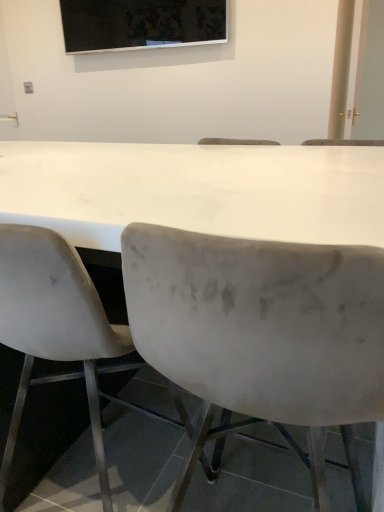
The image size is (384, 512). What are the coordinates of `black glossy screen at upper center` in the screenshot? It's located at (140, 24).

Where is `velvet gray chair at center, the second chair when ordered from left to right`? velvet gray chair at center, the second chair when ordered from left to right is located at coordinates (261, 325).

You are a GUI agent. You are given a task and a screenshot of the screen. Output one action in this format:
    pyautogui.click(x=<x>, y=<y>)
    Task: Click on the chair below the velvet gray chair at center, the second chair when ordered from left to right (from a real-world perspective)
    The width and height of the screenshot is (384, 512).
    Given the screenshot: What is the action you would take?
    click(x=60, y=330)

Considering their positions, is velvet gray chair at center, which is counted as the 1th chair, starting from the right, located in front of or behind white matte chair at left, arranged as the 2th chair when viewed from the right?

In the image, velvet gray chair at center, which is counted as the 1th chair, starting from the right, appears in front of white matte chair at left, arranged as the 2th chair when viewed from the right.

Looking at this image, is velvet gray chair at center, which is counted as the 1th chair, starting from the right, located outside white matte chair at left, positioned as the first chair in left-to-right order?

Yes, velvet gray chair at center, which is counted as the 1th chair, starting from the right, is not within white matte chair at left, positioned as the first chair in left-to-right order.

From a real-world perspective, which object stands above the other?

velvet gray chair at center, which is counted as the 1th chair, starting from the right.

Is white glossy door at upper right bigger or smaller than white matte chair at left, arranged as the 2th chair when viewed from the right?

Clearly, white glossy door at upper right is smaller in size than white matte chair at left, arranged as the 2th chair when viewed from the right.

From a real-world perspective, is white glossy door at upper right positioned above or below white matte chair at left, arranged as the 2th chair when viewed from the right?

white glossy door at upper right is situated higher than white matte chair at left, arranged as the 2th chair when viewed from the right, in the real world.

Which object is wider, white glossy door at upper right or white matte chair at left, arranged as the 2th chair when viewed from the right?

white matte chair at left, arranged as the 2th chair when viewed from the right.

Is white glossy door at upper right positioned behind white matte chair at left, positioned as the first chair in left-to-right order?

Yes.

Which of these two, black glossy screen at upper center or white glossy door at upper right, is wider?

With larger width is black glossy screen at upper center.

From a real-world perspective, who is located higher, black glossy screen at upper center or white glossy door at upper right?

black glossy screen at upper center, from a real-world perspective.

Based on the photo, is black glossy screen at upper center not inside white glossy door at upper right?

That's correct, black glossy screen at upper center is outside of white glossy door at upper right.

Does black glossy screen at upper center appear on the right side of white glossy door at upper right?

No, black glossy screen at upper center is not to the right of white glossy door at upper right.

Is velvet gray chair at center, the second chair when ordered from left to right, inside white matte chair at left, positioned as the first chair in left-to-right order?

No, velvet gray chair at center, the second chair when ordered from left to right, is not surrounded by white matte chair at left, positioned as the first chair in left-to-right order.

Where is `chair above the velvet gray chair at center, the second chair when ordered from left to right (from the image's perspective)`? chair above the velvet gray chair at center, the second chair when ordered from left to right (from the image's perspective) is located at coordinates (60, 330).

Which point is more forward, (35, 337) or (180, 327)?

The point (180, 327) is in front.

Is black glossy screen at upper center completely or partially outside of white matte chair at left, arranged as the 2th chair when viewed from the right?

black glossy screen at upper center is positioned outside white matte chair at left, arranged as the 2th chair when viewed from the right.

Are black glossy screen at upper center and white matte chair at left, positioned as the first chair in left-to-right order, beside each other?

There is a gap between black glossy screen at upper center and white matte chair at left, positioned as the first chair in left-to-right order.

Is the depth of black glossy screen at upper center less than that of white matte chair at left, positioned as the first chair in left-to-right order?

That is False.

From the image's perspective, between white glossy door at upper right and velvet gray chair at center, which is counted as the 1th chair, starting from the right, which one is located above?

white glossy door at upper right appears higher in the image.

From a real-world perspective, is white glossy door at upper right positioned above or below velvet gray chair at center, which is counted as the 1th chair, starting from the right?

white glossy door at upper right is above velvet gray chair at center, which is counted as the 1th chair, starting from the right.

What's the angular difference between white glossy door at upper right and velvet gray chair at center, which is counted as the 1th chair, starting from the right,'s facing directions?

The angular difference between white glossy door at upper right and velvet gray chair at center, which is counted as the 1th chair, starting from the right, is 88.3 degrees.

Is the surface of white glossy door at upper right in direct contact with velvet gray chair at center, which is counted as the 1th chair, starting from the right?

No.

Between white glossy door at upper right and black glossy screen at upper center, which one is positioned behind?

white glossy door at upper right is more distant.

From the image's perspective, between white glossy door at upper right and black glossy screen at upper center, which one is located above?

black glossy screen at upper center, from the image's perspective.

Looking at their sizes, would you say white glossy door at upper right is wider or thinner than black glossy screen at upper center?

Clearly, white glossy door at upper right has less width compared to black glossy screen at upper center.

The width and height of the screenshot is (384, 512). Identify the location of chair located on the right of white matte chair at left, arranged as the 2th chair when viewed from the right. (261, 325).

Find the location of a particular element. the 1st chair positioned below the white glossy door at upper right (from the image's perspective) is located at coordinates (60, 330).

Based on the photo, based on their spatial positions, is white glossy door at upper right or black glossy screen at upper center closer to velvet gray chair at center, which is counted as the 1th chair, starting from the right?

Among the two, white glossy door at upper right is located nearer to velvet gray chair at center, which is counted as the 1th chair, starting from the right.

From the image, which object appears to be farther from white glossy door at upper right, velvet gray chair at center, the second chair when ordered from left to right, or black glossy screen at upper center?

Among the two, velvet gray chair at center, the second chair when ordered from left to right, is located further to white glossy door at upper right.

From the image, which object appears to be nearer to black glossy screen at upper center, white matte chair at left, positioned as the first chair in left-to-right order, or velvet gray chair at center, the second chair when ordered from left to right?

white matte chair at left, positioned as the first chair in left-to-right order.

When comparing their distances from white glossy door at upper right, does black glossy screen at upper center or white matte chair at left, arranged as the 2th chair when viewed from the right, seem closer?

black glossy screen at upper center lies closer to white glossy door at upper right than the other object.

Looking at the image, which one is located further to white glossy door at upper right, velvet gray chair at center, the second chair when ordered from left to right, or white matte chair at left, positioned as the first chair in left-to-right order?

velvet gray chair at center, the second chair when ordered from left to right, is positioned further to the anchor white glossy door at upper right.

Looking at the image, which one is located closer to velvet gray chair at center, which is counted as the 1th chair, starting from the right, black glossy screen at upper center or white glossy door at upper right?

white glossy door at upper right is closer to velvet gray chair at center, which is counted as the 1th chair, starting from the right.

Based on their spatial positions, is white matte chair at left, arranged as the 2th chair when viewed from the right, or white glossy door at upper right further from black glossy screen at upper center?

Based on the image, white matte chair at left, arranged as the 2th chair when viewed from the right, appears to be further to black glossy screen at upper center.

From the image, which object appears to be farther from velvet gray chair at center, the second chair when ordered from left to right, black glossy screen at upper center or white matte chair at left, positioned as the first chair in left-to-right order?

The object further to velvet gray chair at center, the second chair when ordered from left to right, is black glossy screen at upper center.

At what (x,y) coordinates should I click in order to perform the action: click on chair between velvet gray chair at center, which is counted as the 1th chair, starting from the right, and black glossy screen at upper center, along the z-axis. Please return your answer as a coordinate pair (x, y). The height and width of the screenshot is (512, 384). Looking at the image, I should click on (60, 330).

At what (x,y) coordinates should I click in order to perform the action: click on projection screen between velvet gray chair at center, the second chair when ordered from left to right, and white glossy door at upper right in the front-back direction. Please return your answer as a coordinate pair (x, y). This screenshot has height=512, width=384. Looking at the image, I should click on (140, 24).

Find the location of a particular element. The height and width of the screenshot is (512, 384). chair located between velvet gray chair at center, the second chair when ordered from left to right, and white glossy door at upper right in the depth direction is located at coordinates (60, 330).

At what (x,y) coordinates should I click in order to perform the action: click on projection screen located between white matte chair at left, positioned as the first chair in left-to-right order, and white glossy door at upper right in the depth direction. Please return your answer as a coordinate pair (x, y). The height and width of the screenshot is (512, 384). Looking at the image, I should click on (140, 24).